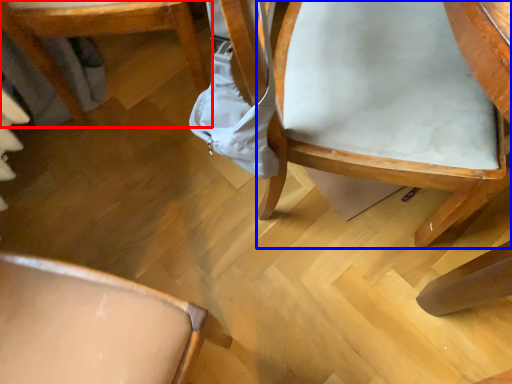
Question: Among these objects, which one is farthest to the camera, chair (highlighted by a red box) or chair (highlighted by a blue box)?

Choices:
 (A) chair
 (B) chair

Answer: (A)